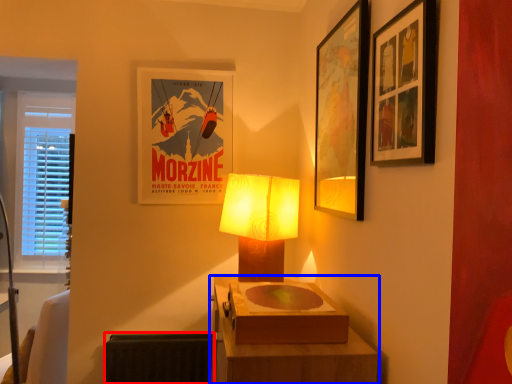
Question: Which object appears closest to the camera in this image, radiator (highlighted by a red box) or table (highlighted by a blue box)?

Choices:
 (A) radiator
 (B) table

Answer: (B)